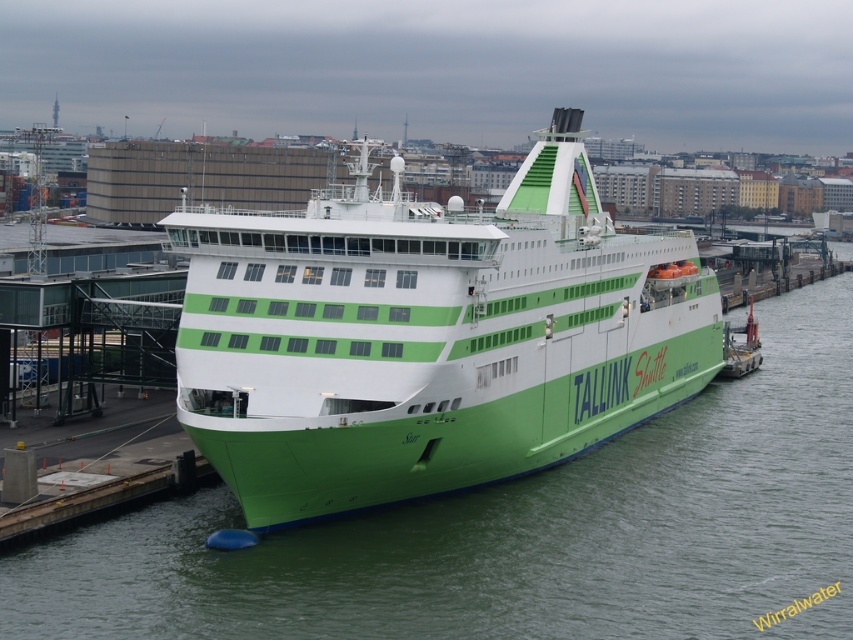
You are a crane operator tasked with lifting cargo from the green matte ship at center to the dock. The green matte water at center is rising due to high tide. Considering their heights, which object will you prioritize lifting first to avoid potential water damage?

The green matte ship at center is much taller than the green matte water at center, so the cargo on the green matte ship at center is less likely to be affected by rising water. Therefore, prioritize lifting cargo from the green matte water at center first to prevent water damage.

You are a passenger on the ferry and want to disembark to the dock. The ferry has a green matte ship at center and a green matte water at center. Which direction should you walk to reach the dock?

The green matte ship at center is positioned on the left side of green matte water at center, so you should walk to the right side of the green matte ship at center to reach the dock.

You are standing on the dock and looking at the ferry. There are two points marked on the ferry. One is at coordinate point (627, 404) and the other at point (100, 524). Which of these points is closer to your viewpoint?

Point (627, 404) is further to the camera than point (100, 524), so the point closer to your viewpoint is point (100, 524).